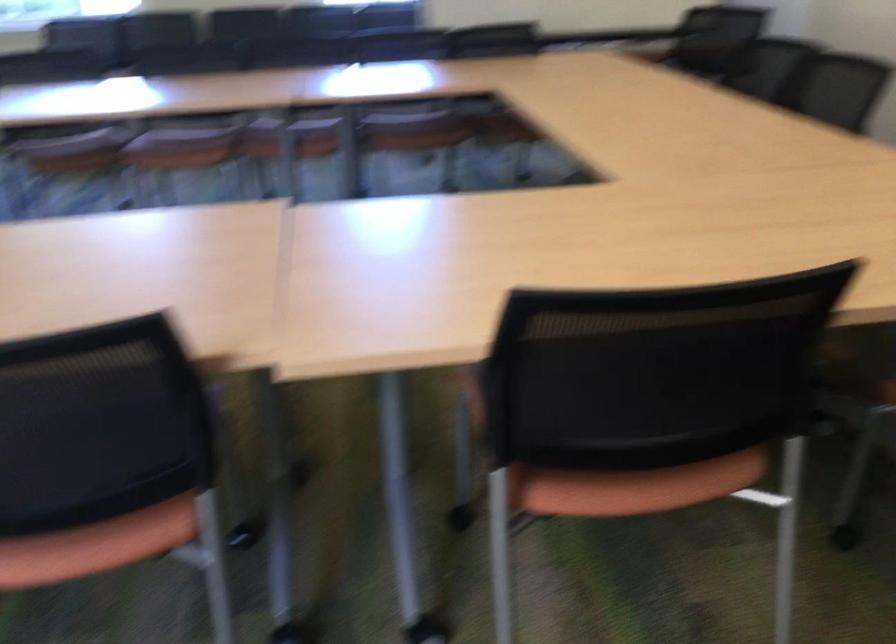
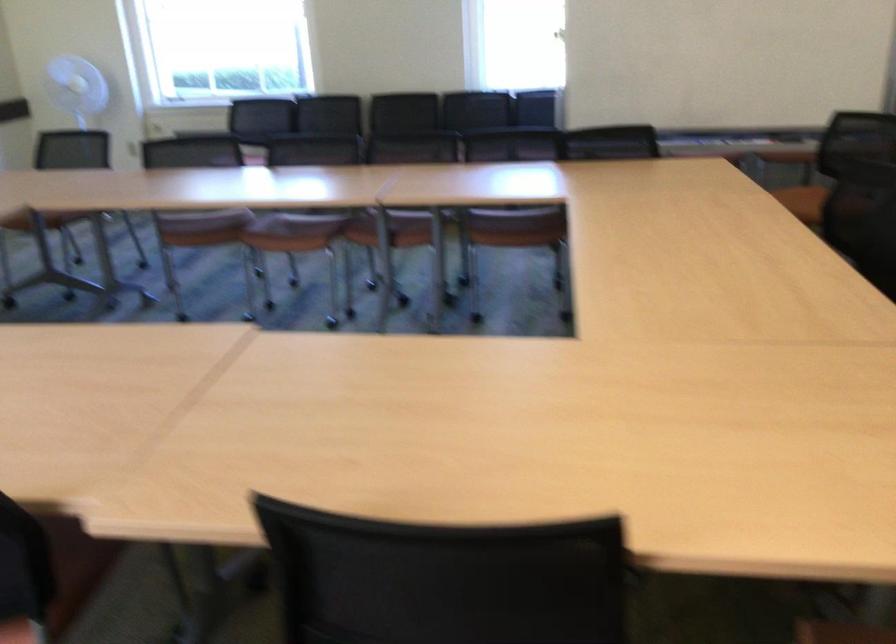
Locate, in the second image, the point that corresponds to point (586, 366) in the first image.

(444, 579)